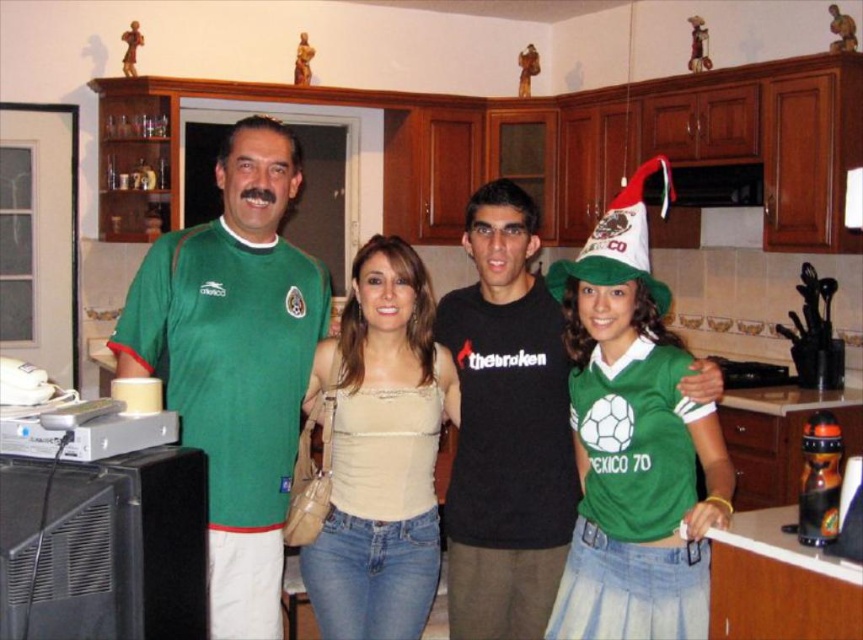
Consider the image. What is the color of the clothing item located at the coordinates point (506, 428) in the image?

The clothing item at point (506, 428) is a black matte t shirt at center.

You are a fashion designer analyzing the image. You need to determine the exact location of the matte green jersey at center in the image. What are its coordinates?

The matte green jersey at center is located at coordinates point (x=244, y=324).